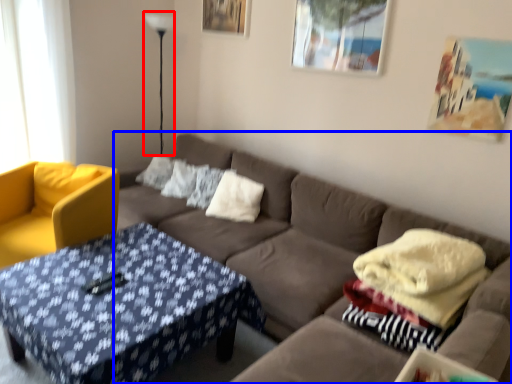
Question: Which point is closer to the camera, lamp (highlighted by a red box) or studio couch (highlighted by a blue box)?

Choices:
 (A) lamp
 (B) studio couch

Answer: (B)